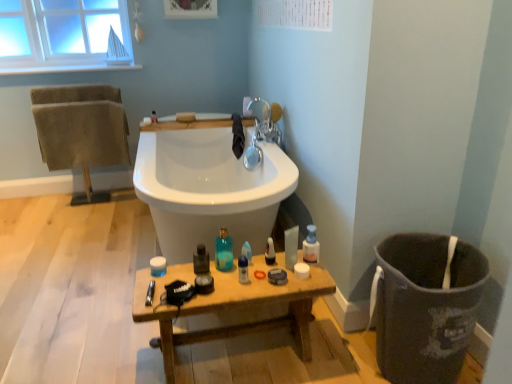
Question: Can we say translucent plastic bottle at center, which appears as the third toiletry when viewed from the front, lies outside silver metallic faucet at upper center?

Choices:
 (A) yes
 (B) no

Answer: (A)

Question: From the image's perspective, is translucent plastic bottle at center, the 2th toiletry from the top, above silver metallic faucet at upper center?

Choices:
 (A) yes
 (B) no

Answer: (B)

Question: Considering the relative positions of translucent plastic bottle at center, which appears as the third toiletry when viewed from the front, and silver metallic faucet at upper center in the image provided, is translucent plastic bottle at center, which appears as the third toiletry when viewed from the front, behind silver metallic faucet at upper center?

Choices:
 (A) no
 (B) yes

Answer: (A)

Question: Is translucent plastic bottle at center, the 2th toiletry from the top, touching silver metallic faucet at upper center?

Choices:
 (A) yes
 (B) no

Answer: (B)

Question: Is translucent plastic bottle at center, the 2th toiletry from the top, surrounding silver metallic faucet at upper center?

Choices:
 (A) no
 (B) yes

Answer: (A)

Question: Is translucent plastic bottle at center, which appears as the 1th toiletry when viewed from the right, looking in the opposite direction of silver metallic faucet at upper center?

Choices:
 (A) yes
 (B) no

Answer: (A)

Question: From the image's perspective, would you say wooden table at lower center is positioned over black cloth at upper center, which appears as the second bath towel when viewed from the left?

Choices:
 (A) no
 (B) yes

Answer: (A)

Question: Could you tell me if wooden table at lower center is turned towards black cloth at upper center, which is counted as the 1th bath towel, starting from the right?

Choices:
 (A) yes
 (B) no

Answer: (B)

Question: Is wooden table at lower center completely or partially outside of black cloth at upper center, which is counted as the 1th bath towel, starting from the right?

Choices:
 (A) yes
 (B) no

Answer: (A)

Question: Considering the relative sizes of wooden table at lower center and black cloth at upper center, which is counted as the 1th bath towel, starting from the right, in the image provided, is wooden table at lower center shorter than black cloth at upper center, which is counted as the 1th bath towel, starting from the right,?

Choices:
 (A) no
 (B) yes

Answer: (A)

Question: Can you confirm if wooden table at lower center is bigger than black cloth at upper center, which is counted as the 1th bath towel, starting from the right?

Choices:
 (A) no
 (B) yes

Answer: (B)

Question: Considering the relative sizes of wooden table at lower center and black cloth at upper center, which is counted as the 1th bath towel, starting from the right, in the image provided, is wooden table at lower center taller than black cloth at upper center, which is counted as the 1th bath towel, starting from the right,?

Choices:
 (A) no
 (B) yes

Answer: (B)

Question: From a real-world perspective, is translucent plastic spray bottle at center, the 1th cleaning product when ordered from left to right, under translucent blue glass bottle at center, the first toiletry from the front?

Choices:
 (A) yes
 (B) no

Answer: (A)